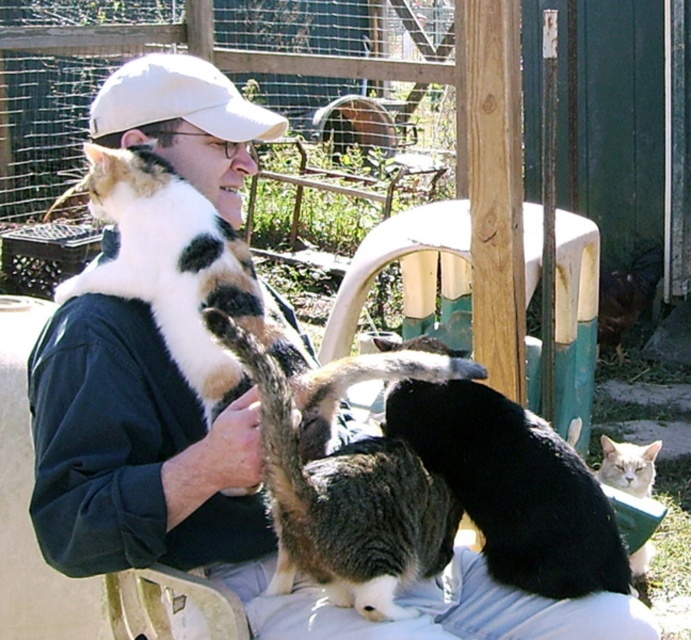
Is black fur cat at center wider than white fabric cap at upper center?

Indeed, black fur cat at center has a greater width compared to white fabric cap at upper center.

Which is more to the right, black fur cat at center or white fabric cap at upper center?

black fur cat at center

Is point (623, 554) positioned after point (227, 128)?

That is False.

The image size is (691, 640). Identify the location of black fur cat at center. (513, 486).

Is gray tabby cat at center wider than white fabric cap at upper center?

Correct, the width of gray tabby cat at center exceeds that of white fabric cap at upper center.

Does point (401, 460) come farther from viewer compared to point (211, 122)?

No, it is not.

Who is more forward, [359,536] or [164,90]?

Positioned in front is point [359,536].

Identify the location of gray tabby cat at center. (343, 500).

Does gray tabby cat at center have a greater height compared to black fur cat at center?

Yes.

Between point (319, 584) and point (547, 525), which one is positioned in front?

Point (319, 584)

Locate an element on the screen. The image size is (691, 640). gray tabby cat at center is located at coordinates (343, 500).